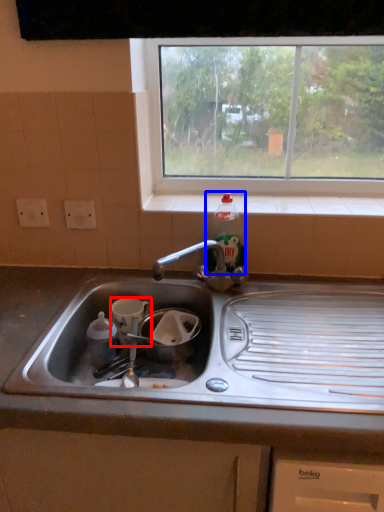
Question: Which object appears closest to the camera in this image, appliance (highlighted by a red box) or bottle (highlighted by a blue box)?

Choices:
 (A) appliance
 (B) bottle

Answer: (A)